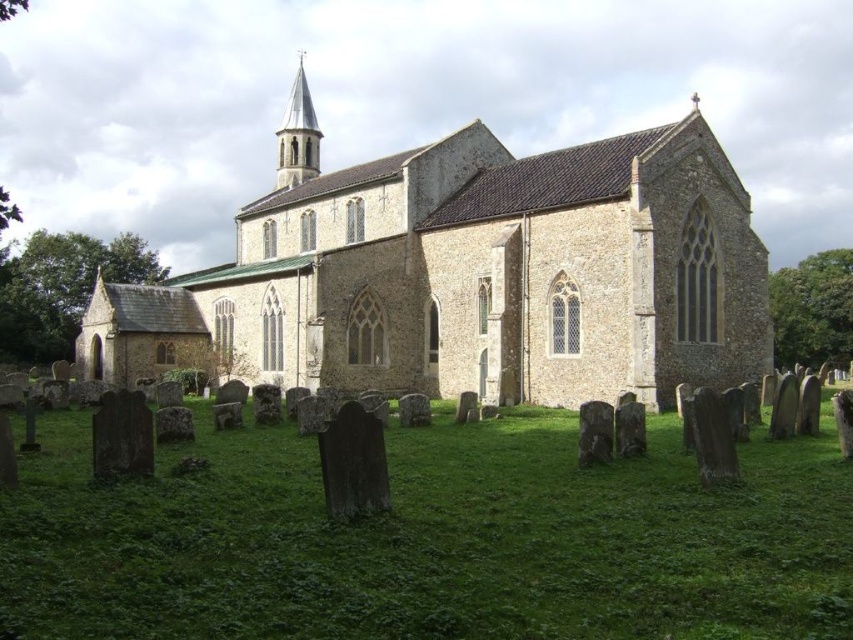
You are standing in the graveyard and want to place a new gravestone. The stone church at center is in your way. Can you walk around it to reach the green grass at lower center where you want to place the gravestone?

The green grass at lower center is positioned under the stone church at center, so you cannot walk around the stone church at center to reach the green grass at lower center as it is located beneath it.

You are standing in the graveyard looking towards the church. Which area takes up more visual space in the image, the green grass at lower center or the stone church at center?

The stone church at center occupies more visual space than the green grass at lower center according to the description provided.

You are standing in front of the historic stone church and want to walk towards the green grass at lower center and the white stone spire at upper center. Which one will you physically step onto first?

You will step onto the green grass at lower center first because it is closer to you than the white stone spire at upper center.